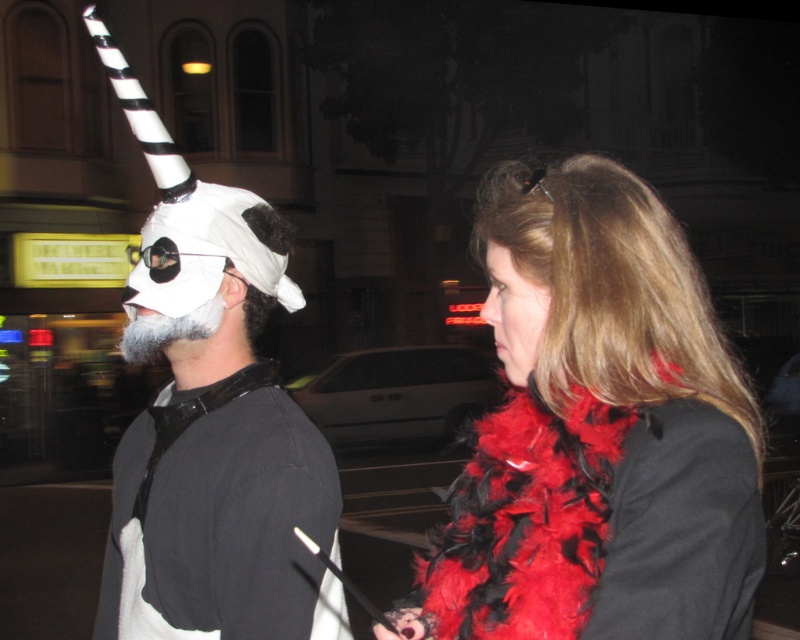
You are a photographer trying to capture a clear photo of the feather boa at right and the smooth red scarf at right. Which object should you focus on first if you want to ensure both are in focus without moving the camera?

The feather boa at right is much taller than the smooth red scarf at right, so you should focus on the feather boa at right first to ensure both are in focus.

You are a photographer at the event and want to take a photo where the white matte mask at left is fully visible. What should you do about the feather boa at right?

Move the feather boa at right away from the white matte mask at left since the feather boa at right is currently positioned over it and blocking the view.

You are a photographer trying to capture a photo of the two people in the scene. You want to ensure that both the white matte mask at left and the smooth red scarf at right are clearly visible. Based on their positions, which object should you focus on first to ensure both are in frame?

The white matte mask at left is positioned on the left side of the smooth red scarf at right, so you should focus on the white matte mask at left first to ensure both are in frame.